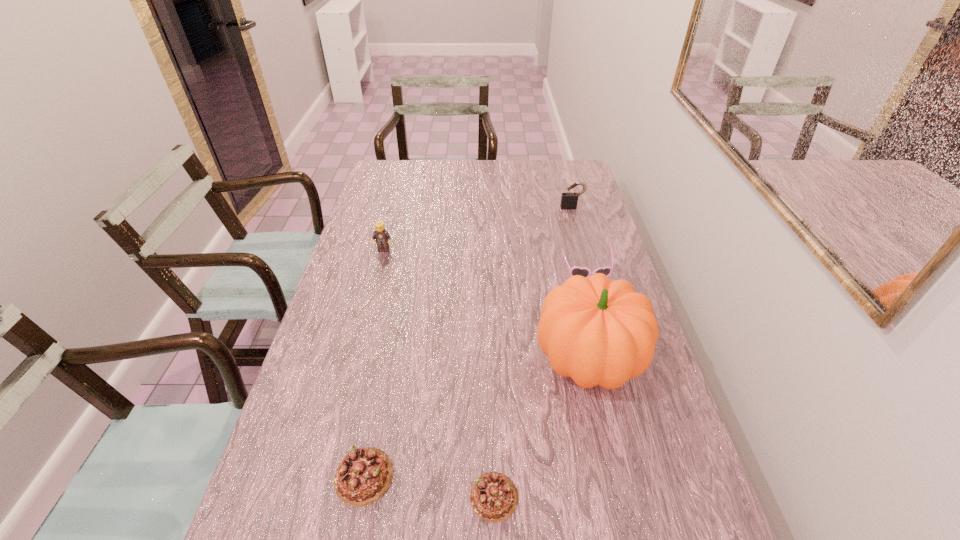
Please point out where to position a new chocolate cake on the right to maintain spacing. Please provide its 2D coordinates. Your answer should be formatted as a tuple, i.e. [(x, y)], where the tuple contains the x and y coordinates of a point satisfying the conditions above.

[(634, 518)]